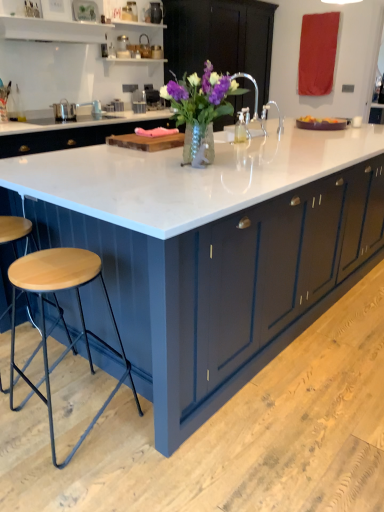
Question: Would you say wooden seat stool at lower left contains white marble countertop at center?

Choices:
 (A) no
 (B) yes

Answer: (A)

Question: Does wooden seat stool at lower left have a greater height compared to white marble countertop at center?

Choices:
 (A) no
 (B) yes

Answer: (A)

Question: Considering the relative positions of wooden seat stool at lower left and white marble countertop at center in the image provided, is wooden seat stool at lower left to the right of white marble countertop at center from the viewer's perspective?

Choices:
 (A) no
 (B) yes

Answer: (A)

Question: Is wooden seat stool at lower left positioned before white marble countertop at center?

Choices:
 (A) no
 (B) yes

Answer: (A)

Question: Does wooden seat stool at lower left have a larger size compared to white marble countertop at center?

Choices:
 (A) yes
 (B) no

Answer: (B)

Question: Does wooden seat stool at lower left touch white marble countertop at center?

Choices:
 (A) yes
 (B) no

Answer: (B)

Question: Is white marble countertop at center at the right side of wooden cutting board at center?

Choices:
 (A) no
 (B) yes

Answer: (B)

Question: Does white marble countertop at center turn towards wooden cutting board at center?

Choices:
 (A) no
 (B) yes

Answer: (A)

Question: Would you consider white marble countertop at center to be distant from wooden cutting board at center?

Choices:
 (A) yes
 (B) no

Answer: (B)

Question: Does white marble countertop at center have a lesser height compared to wooden cutting board at center?

Choices:
 (A) no
 (B) yes

Answer: (A)

Question: Is white marble countertop at center not within wooden cutting board at center?

Choices:
 (A) yes
 (B) no

Answer: (A)

Question: From the image's perspective, would you say white marble countertop at center is positioned over wooden cutting board at center?

Choices:
 (A) yes
 (B) no

Answer: (B)

Question: Does wooden seat stool at lower left appear on the left side of translucent glass vase with purple flowers at center?

Choices:
 (A) no
 (B) yes

Answer: (B)